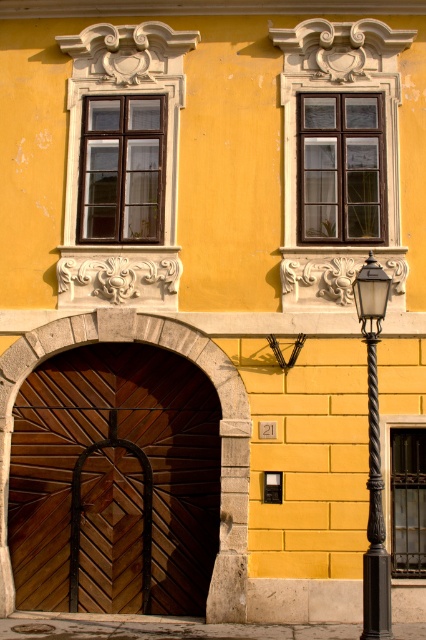
Question: In this image, where is wooden at center located relative to matte black lamp post at right?

Choices:
 (A) left
 (B) right

Answer: (A)

Question: Is wooden at center positioned at the back of matte black lamp post at right?

Choices:
 (A) yes
 (B) no

Answer: (A)

Question: Is wooden at center smaller than matte black lamp post at right?

Choices:
 (A) yes
 (B) no

Answer: (B)

Question: Among these objects, which one is farthest from the camera?

Choices:
 (A) wooden at center
 (B) matte black lamp post at right

Answer: (A)